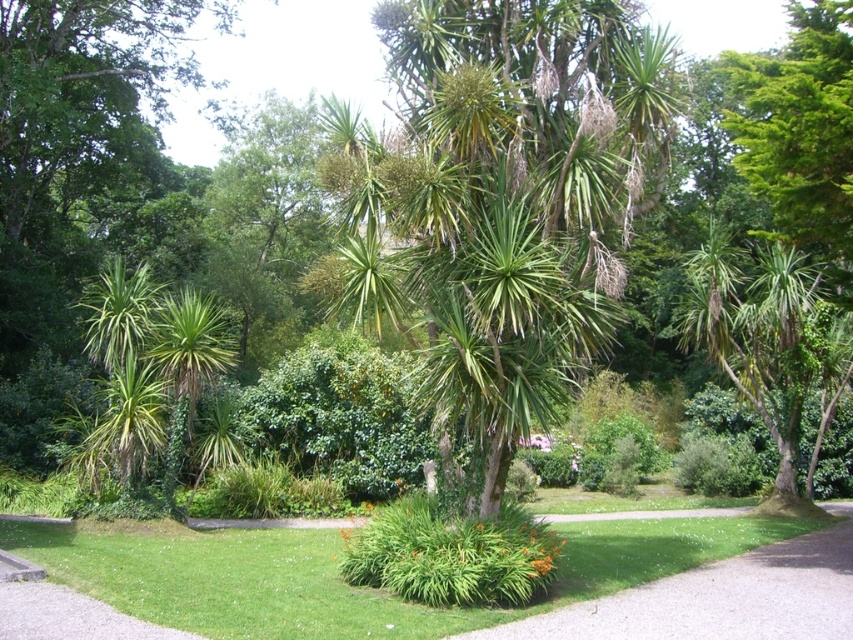
Can you confirm if green leafy grass at lower center is shorter than green grass at lower center?

No, green leafy grass at lower center is not shorter than green grass at lower center.

Does green leafy grass at lower center have a smaller size compared to green grass at lower center?

No.

You are a GUI agent. You are given a task and a screenshot of the screen. Output one action in this format:
    pyautogui.click(x=<x>, y=<y>)
    Task: Click on the green leafy grass at lower center
    Image resolution: width=853 pixels, height=640 pixels.
    Given the screenshot: What is the action you would take?
    pyautogui.click(x=720, y=598)

Looking at this image, between green leafy palm tree at center and green leafy grass at lower center, which one appears on the left side from the viewer's perspective?

green leafy palm tree at center is more to the left.

Can you confirm if green leafy palm tree at center is bigger than green leafy grass at lower center?

No.

Which is behind, point (526, 289) or point (828, 560)?

Point (828, 560)

I want to click on green leafy palm tree at center, so click(x=519, y=195).

Who is positioned more to the left, green leafy grass at lower center or green leafy bush at center?

green leafy bush at center is more to the left.

Between point (595, 636) and point (402, 467), which one is positioned behind?

The point (402, 467) is more distant.

Identify the location of green leafy grass at lower center. The height and width of the screenshot is (640, 853). (720, 598).